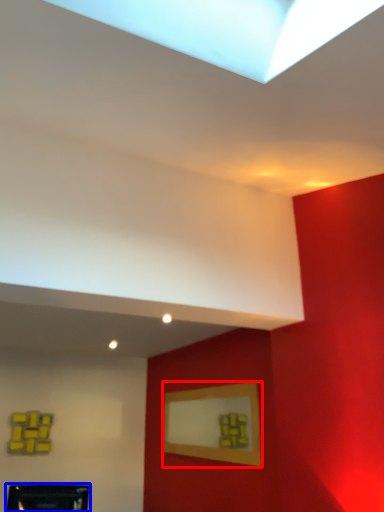
Question: Which object appears closest to the camera in this image, picture frame (highlighted by a red box) or picture frame (highlighted by a blue box)?

Choices:
 (A) picture frame
 (B) picture frame

Answer: (B)